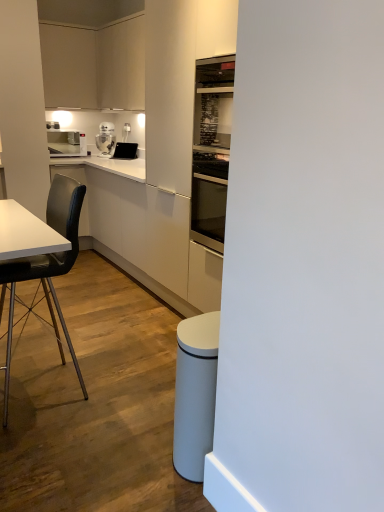
Where is `vacant area that lies to the right of black matte chair at left`? The image size is (384, 512). vacant area that lies to the right of black matte chair at left is located at coordinates (130, 390).